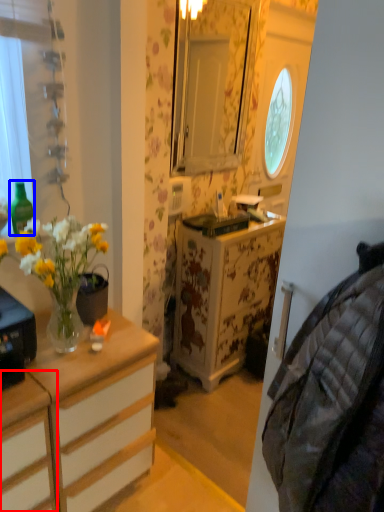
Question: Which of the following is the farthest to the observer, cabinetry (highlighted by a red box) or bottle (highlighted by a blue box)?

Choices:
 (A) cabinetry
 (B) bottle

Answer: (B)